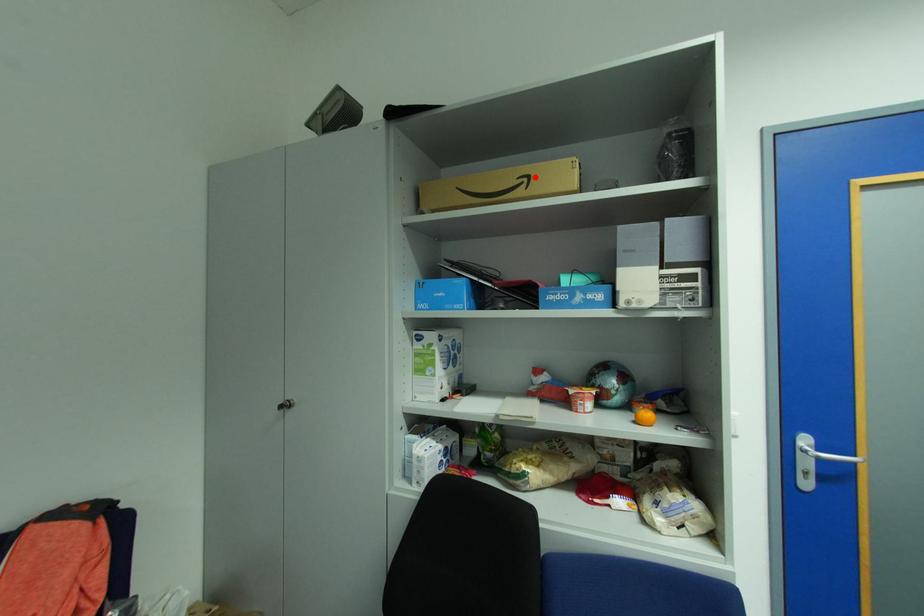
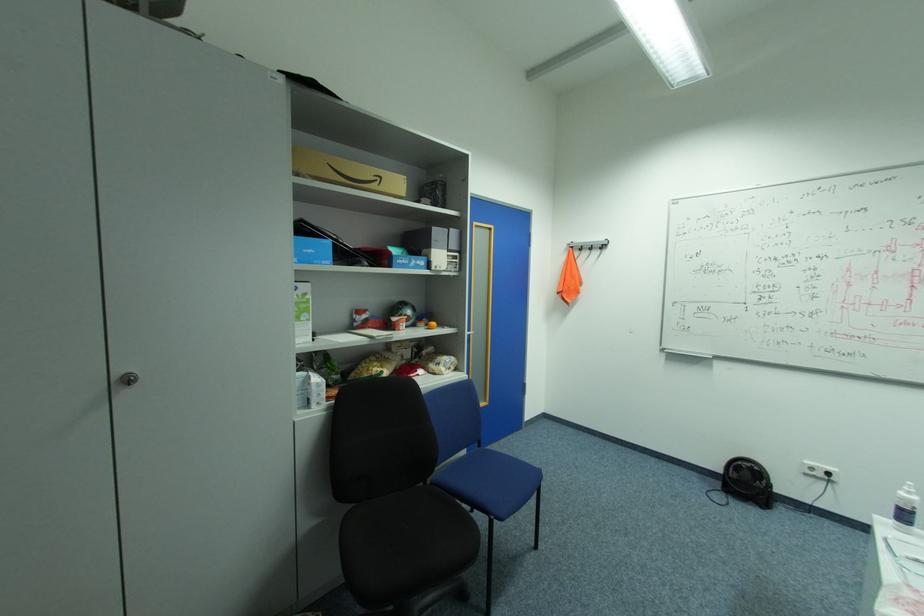
In the second image, find the point that corresponds to the highlighted location in the first image.

(386, 177)